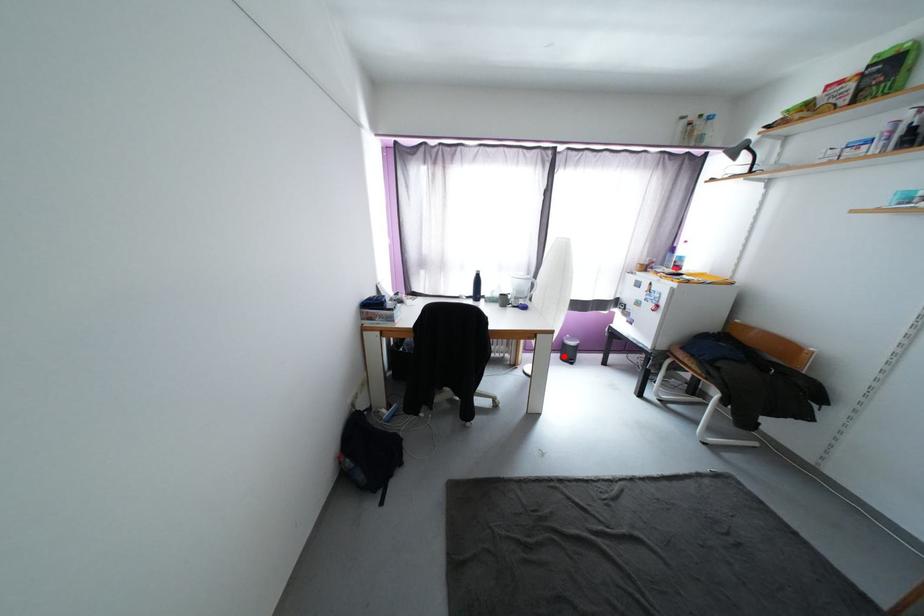
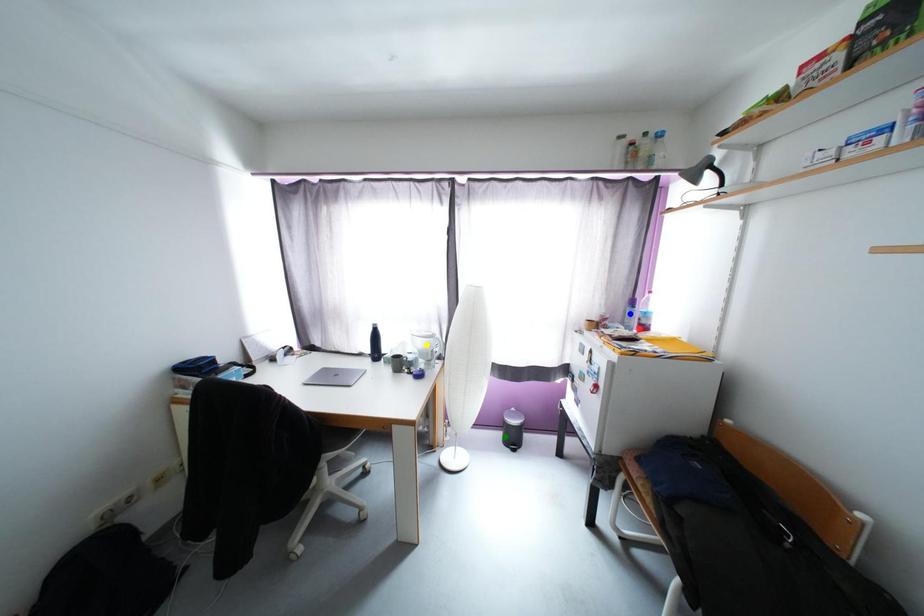
Question: I am providing you with two images of the same scene from different viewpoints. A red point is marked on the first image. You are given multiple points on the second image. Which point in image 2 is actually the same real-world point as the red point in image 1?

Choices:
 (A) yellow point
 (B) blue point
 (C) green point

Answer: (C)